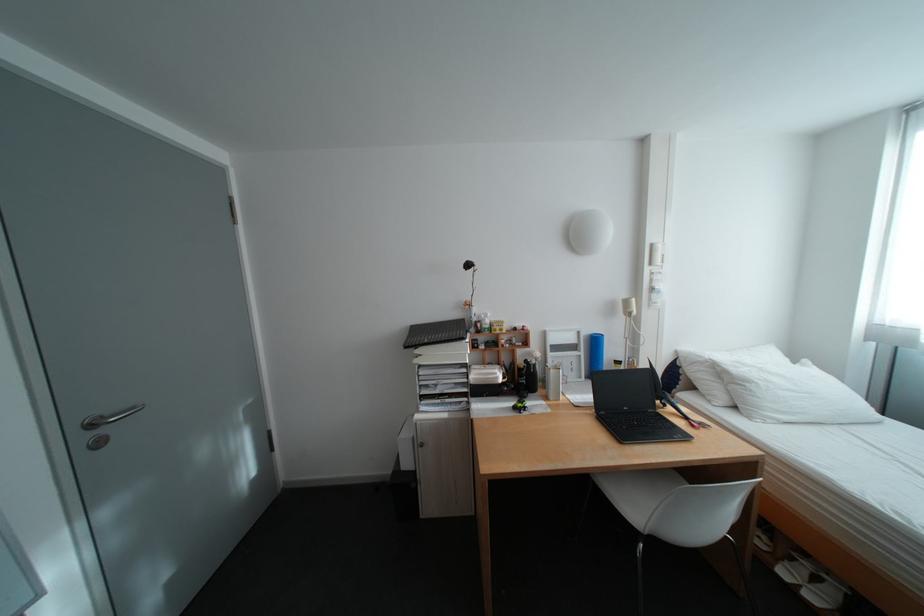
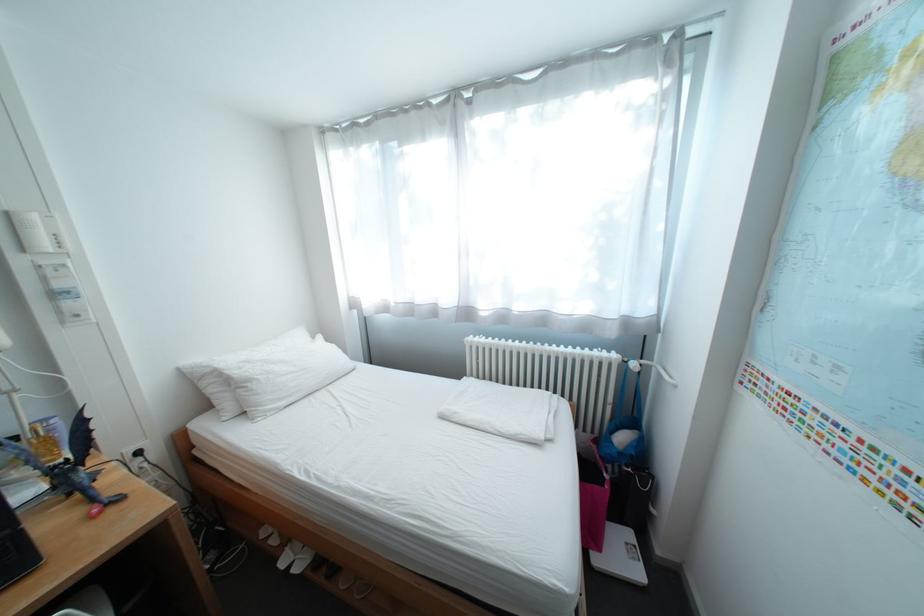
Find the pixel in the second image that matches the point at 677,407 in the first image.

(81, 495)